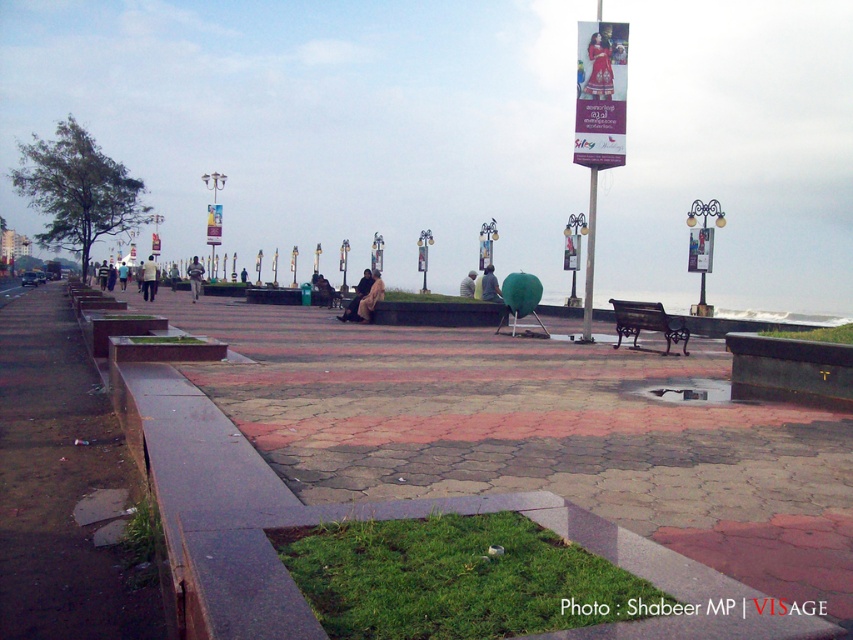
Can you confirm if light brown fabric at center is smaller than dark brown leather jacket at center?

Correct, light brown fabric at center occupies less space than dark brown leather jacket at center.

Is point (373, 276) closer to camera compared to point (344, 310)?

Yes, it is.

Is point (368, 317) positioned after point (363, 275)?

No.

Where is `light brown fabric at center`? The image size is (853, 640). light brown fabric at center is located at coordinates (370, 298).

Between metallic pole at center and light brown fabric person at center, which one appears on the left side from the viewer's perspective?

light brown fabric person at center is more to the left.

Can you confirm if metallic pole at center is positioned above light brown fabric person at center?

Actually, metallic pole at center is below light brown fabric person at center.

Which is behind, point (589, 332) or point (126, 269)?

Point (126, 269)

The height and width of the screenshot is (640, 853). What are the coordinates of `metallic pole at center` in the screenshot? It's located at (589, 259).

Is point (592, 51) more distant than point (352, 308)?

No, it is in front of (352, 308).

Is matte red dress at upper center below dark brown leather jacket at center?

Actually, matte red dress at upper center is above dark brown leather jacket at center.

Measure the distance between matte red dress at upper center and camera.

matte red dress at upper center is 49.51 feet from camera.

At what (x,y) coordinates should I click in order to perform the action: click on matte red dress at upper center. Please return your answer as a coordinate pair (x, y). The image size is (853, 640). Looking at the image, I should click on (598, 68).